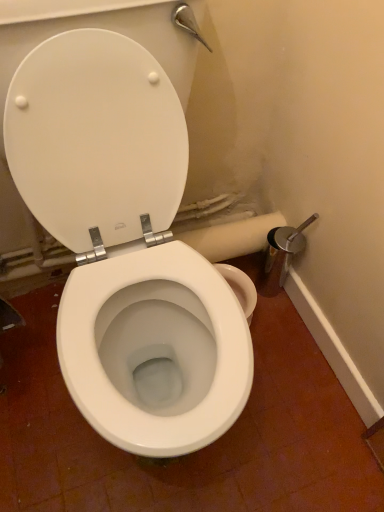
Question: Does white matte toilet paper at center have a lesser height compared to white glossy toilet at center?

Choices:
 (A) no
 (B) yes

Answer: (B)

Question: From a real-world perspective, is white matte toilet paper at center below white glossy toilet at center?

Choices:
 (A) no
 (B) yes

Answer: (B)

Question: From the image's perspective, is white matte toilet paper at center on white glossy toilet at center?

Choices:
 (A) yes
 (B) no

Answer: (A)

Question: Is white matte toilet paper at center positioned far away from white glossy toilet at center?

Choices:
 (A) no
 (B) yes

Answer: (A)

Question: From a real-world perspective, is white matte toilet paper at center positioned over white glossy toilet at center based on gravity?

Choices:
 (A) yes
 (B) no

Answer: (B)

Question: Considering the relative sizes of white matte toilet paper at center and white glossy toilet at center in the image provided, is white matte toilet paper at center smaller than white glossy toilet at center?

Choices:
 (A) yes
 (B) no

Answer: (A)

Question: Can white plastic toilet seat at center be found inside white glossy toilet at center?

Choices:
 (A) no
 (B) yes

Answer: (B)

Question: Is the position of white glossy toilet at center less distant than that of white plastic toilet seat at center?

Choices:
 (A) no
 (B) yes

Answer: (B)

Question: From a real-world perspective, is white glossy toilet at center located higher than white plastic toilet seat at center?

Choices:
 (A) yes
 (B) no

Answer: (A)

Question: Is white glossy toilet at center to the right of white plastic toilet seat at center from the viewer's perspective?

Choices:
 (A) no
 (B) yes

Answer: (B)

Question: Is white glossy toilet at center bigger than white plastic toilet seat at center?

Choices:
 (A) yes
 (B) no

Answer: (A)

Question: Can you confirm if white glossy toilet at center is smaller than white plastic toilet seat at center?

Choices:
 (A) yes
 (B) no

Answer: (B)

Question: Is white plastic toilet seat at center positioned with its back to white glossy toilet at center?

Choices:
 (A) no
 (B) yes

Answer: (B)